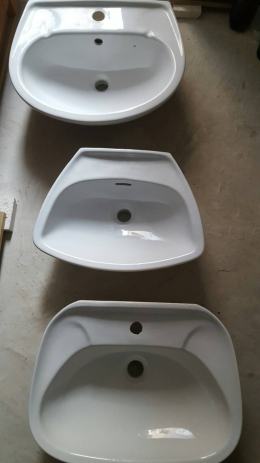
At what (x,y) coordinates should I click in order to perform the action: click on sink. Please return your answer as a coordinate pair (x, y). Looking at the image, I should click on (131, 403), (111, 246), (111, 99).